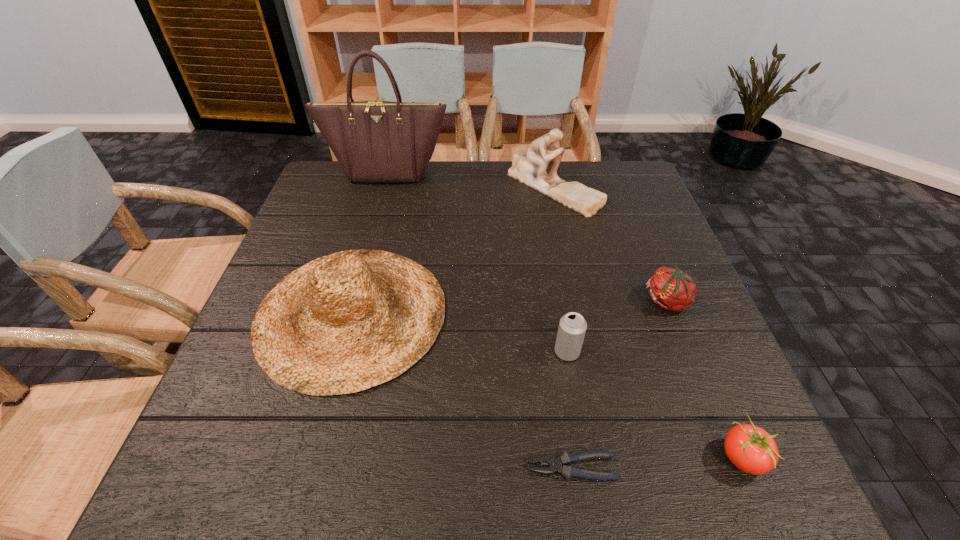
Locate an element on the screen. The height and width of the screenshot is (540, 960). handbag present at the left edge is located at coordinates (374, 141).

Where is `sunhat positioned at the left edge`? The height and width of the screenshot is (540, 960). sunhat positioned at the left edge is located at coordinates (345, 322).

Locate an element on the screen. The width and height of the screenshot is (960, 540). figurine at the right edge is located at coordinates coord(529,167).

Image resolution: width=960 pixels, height=540 pixels. What are the coordinates of `object that is at the far left corner` in the screenshot? It's located at (374, 141).

At what (x,y) coordinates should I click in order to perform the action: click on object that is at the far right corner. Please return your answer as a coordinate pair (x, y). The height and width of the screenshot is (540, 960). Looking at the image, I should click on (529, 167).

Find the location of `object that is at the near right corner`. object that is at the near right corner is located at coordinates (751, 449).

In the image, there is a desktop. Where is `free space at the far edge`? The image size is (960, 540). free space at the far edge is located at coordinates (421, 193).

In the image, there is a desktop. Where is `vacant space at the near edge`? The height and width of the screenshot is (540, 960). vacant space at the near edge is located at coordinates (307, 442).

Identify the location of vacant space at the right edge of the desktop. The height and width of the screenshot is (540, 960). (637, 233).

Locate an element on the screen. The height and width of the screenshot is (540, 960). vacant space at the far right corner of the desktop is located at coordinates (618, 166).